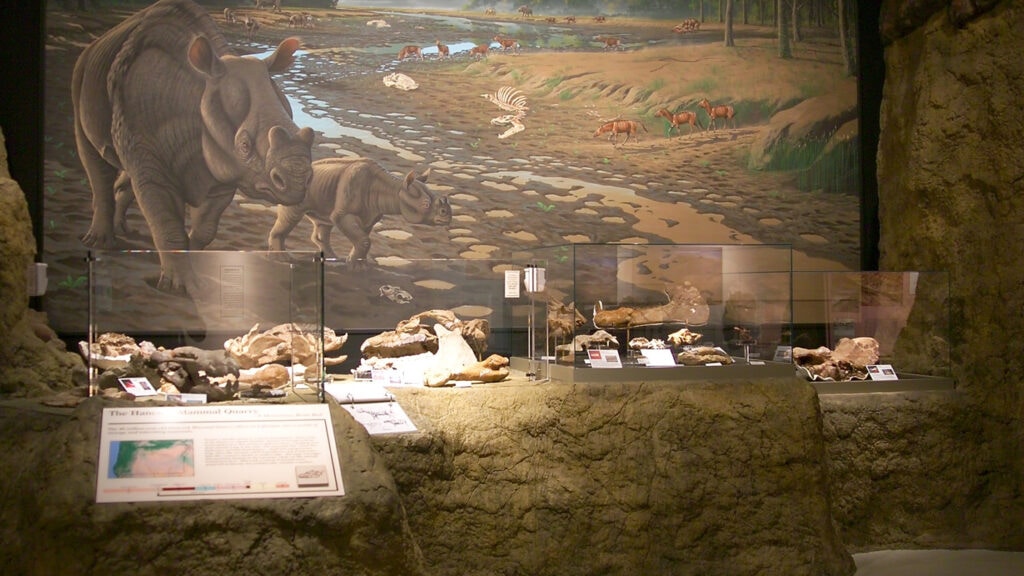
I want to click on info screen, so click(x=252, y=422).